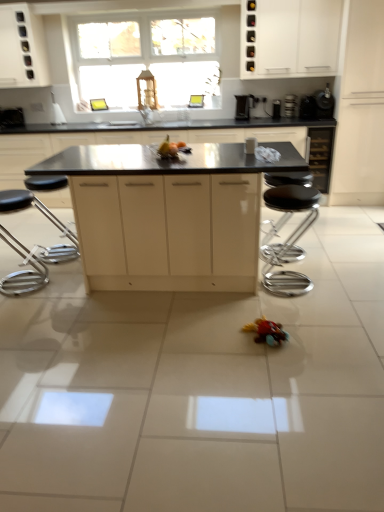
Question: Are matte yellow fruit at center, arranged as the 2th toy when viewed from the right, and black glass wine cabinet at right, marked as the fifth cabinetry in a left-to-right arrangement, located far from each other?

Choices:
 (A) no
 (B) yes

Answer: (B)

Question: Does matte yellow fruit at center, placed as the 1th toy when sorted from top to bottom, have a lesser height compared to black glass wine cabinet at right, the 2th cabinetry in the right-to-left sequence?

Choices:
 (A) yes
 (B) no

Answer: (A)

Question: Is matte yellow fruit at center, the 1th toy viewed from the back, located outside black glass wine cabinet at right, marked as the fifth cabinetry in a left-to-right arrangement?

Choices:
 (A) no
 (B) yes

Answer: (B)

Question: Is matte yellow fruit at center, arranged as the 2th toy when viewed from the right, taller than black glass wine cabinet at right, the 2th cabinetry in the right-to-left sequence?

Choices:
 (A) no
 (B) yes

Answer: (A)

Question: Considering the relative positions of matte yellow fruit at center, marked as the 2th toy in a bottom-to-top arrangement, and black glass wine cabinet at right, marked as the fifth cabinetry in a left-to-right arrangement, in the image provided, is matte yellow fruit at center, marked as the 2th toy in a bottom-to-top arrangement, behind black glass wine cabinet at right, marked as the fifth cabinetry in a left-to-right arrangement,?

Choices:
 (A) yes
 (B) no

Answer: (B)

Question: Can you confirm if matte yellow fruit at center, positioned as the first toy in left-to-right order, is smaller than black glass wine cabinet at right, the 2th cabinetry in the right-to-left sequence?

Choices:
 (A) no
 (B) yes

Answer: (B)

Question: Does black matte island at center, positioned as the fifth cabinetry in right-to-left order, have a lesser height compared to matte yellow fruit at center, which is counted as the second toy, starting from the front?

Choices:
 (A) no
 (B) yes

Answer: (A)

Question: Is matte yellow fruit at center, the 1th toy viewed from the back, at the back of black matte island at center, positioned as the fifth cabinetry in right-to-left order?

Choices:
 (A) no
 (B) yes

Answer: (A)

Question: Would you say matte yellow fruit at center, arranged as the 2th toy when viewed from the right, is part of black matte island at center, positioned as the fifth cabinetry in right-to-left order,'s contents?

Choices:
 (A) no
 (B) yes

Answer: (A)

Question: Can you confirm if black matte island at center, which appears as the 2th cabinetry when viewed from the left, is wider than matte yellow fruit at center, arranged as the 2th toy when viewed from the right?

Choices:
 (A) no
 (B) yes

Answer: (B)

Question: Is black matte island at center, which appears as the 2th cabinetry when viewed from the left, oriented towards matte yellow fruit at center, the 1th toy viewed from the back?

Choices:
 (A) no
 (B) yes

Answer: (B)

Question: Is black matte island at center, which appears as the 2th cabinetry when viewed from the left, next to matte yellow fruit at center, placed as the 1th toy when sorted from top to bottom, and touching it?

Choices:
 (A) yes
 (B) no

Answer: (B)

Question: Is yellow matte fruit at center wider than matte yellow fruit at center, which is counted as the second toy, starting from the front?

Choices:
 (A) yes
 (B) no

Answer: (B)